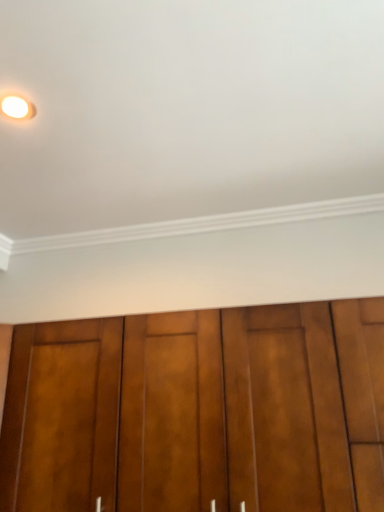
Question: Should I look upward or downward to see matte white light fixture at upper left?

Choices:
 (A) down
 (B) up

Answer: (B)

Question: Does matte white light fixture at upper left have a lesser width compared to brown wood door at lower center?

Choices:
 (A) no
 (B) yes

Answer: (B)

Question: Is the surface of matte white light fixture at upper left in direct contact with brown wood door at lower center?

Choices:
 (A) yes
 (B) no

Answer: (B)

Question: Considering the relative sizes of matte white light fixture at upper left and brown wood door at lower center in the image provided, is matte white light fixture at upper left bigger than brown wood door at lower center?

Choices:
 (A) yes
 (B) no

Answer: (B)

Question: From the image's perspective, would you say matte white light fixture at upper left is shown under brown wood door at lower center?

Choices:
 (A) no
 (B) yes

Answer: (A)

Question: Does matte white light fixture at upper left have a greater height compared to brown wood door at lower center?

Choices:
 (A) no
 (B) yes

Answer: (A)

Question: Can you confirm if matte white light fixture at upper left is wider than brown wood door at lower center?

Choices:
 (A) yes
 (B) no

Answer: (B)

Question: Considering the relative sizes of brown wood door at lower center and matte white light fixture at upper left in the image provided, is brown wood door at lower center taller than matte white light fixture at upper left?

Choices:
 (A) no
 (B) yes

Answer: (B)

Question: From a real-world perspective, is brown wood door at lower center positioned under matte white light fixture at upper left based on gravity?

Choices:
 (A) yes
 (B) no

Answer: (A)

Question: Is brown wood door at lower center oriented towards matte white light fixture at upper left?

Choices:
 (A) yes
 (B) no

Answer: (B)

Question: From the image's perspective, is brown wood door at lower center above matte white light fixture at upper left?

Choices:
 (A) yes
 (B) no

Answer: (B)

Question: Are brown wood door at lower center and matte white light fixture at upper left located far from each other?

Choices:
 (A) no
 (B) yes

Answer: (A)

Question: Can you confirm if brown wood door at lower center is shorter than matte white light fixture at upper left?

Choices:
 (A) yes
 (B) no

Answer: (B)

Question: Is brown wood door at lower center bigger or smaller than matte white light fixture at upper left?

Choices:
 (A) big
 (B) small

Answer: (A)